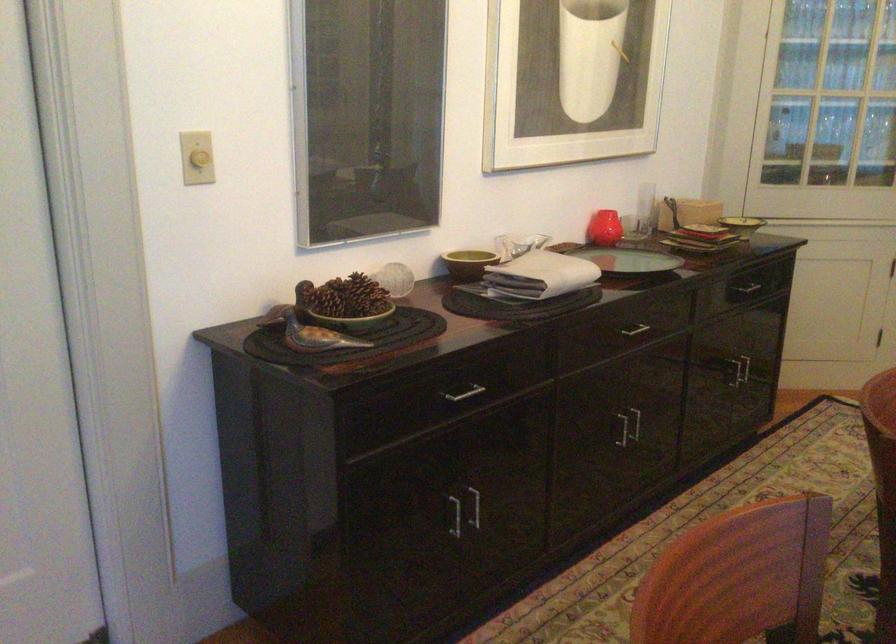
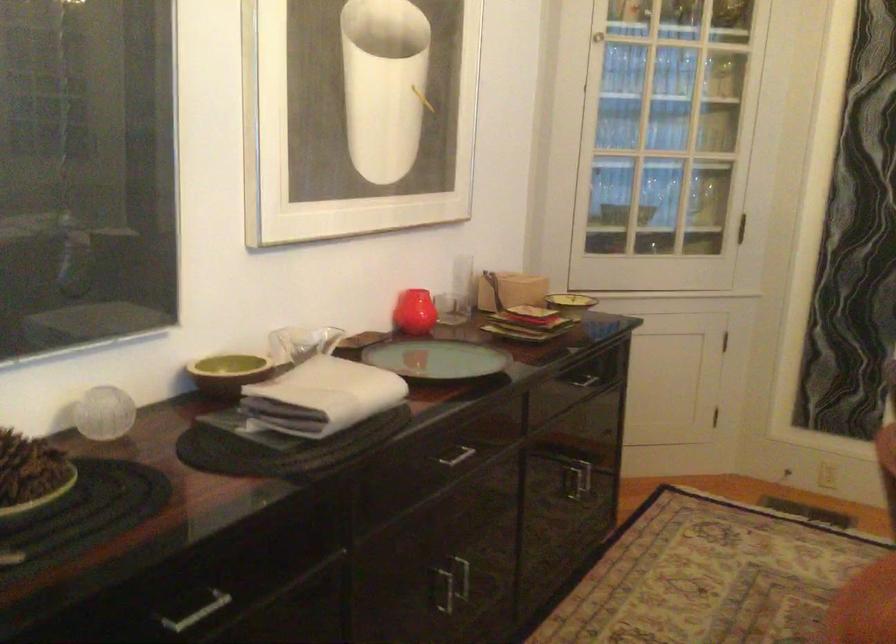
Question: Based on the continuous images, in which direction is the camera rotating? Reply with the corresponding letter.

Choices:
 (A) Left
 (B) Right
 (C) Up
 (D) Down

Answer: (B)